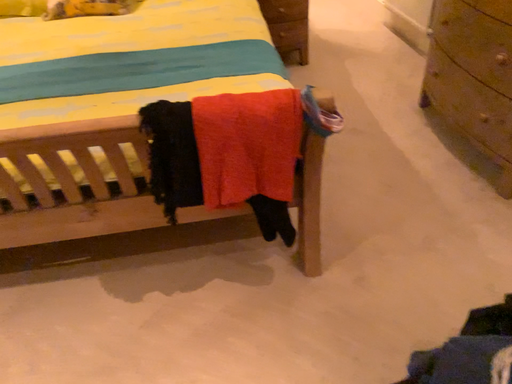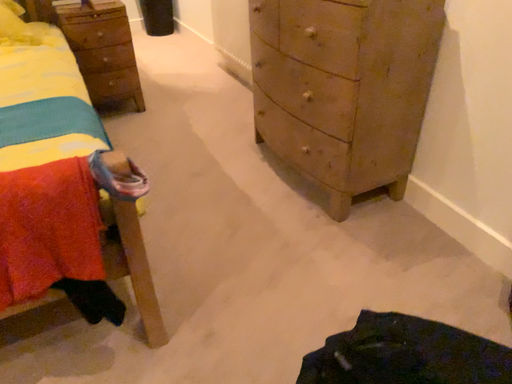
Question: Which way did the camera rotate in the video?

Choices:
 (A) rotated right
 (B) rotated left

Answer: (A)